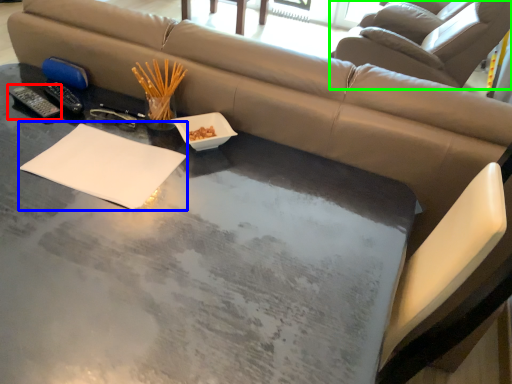
Question: Based on their relative distances, which object is nearer to remote (highlighted by a red box)? Choose from notepad (highlighted by a blue box) and swivel chair (highlighted by a green box).

Choices:
 (A) notepad
 (B) swivel chair

Answer: (A)